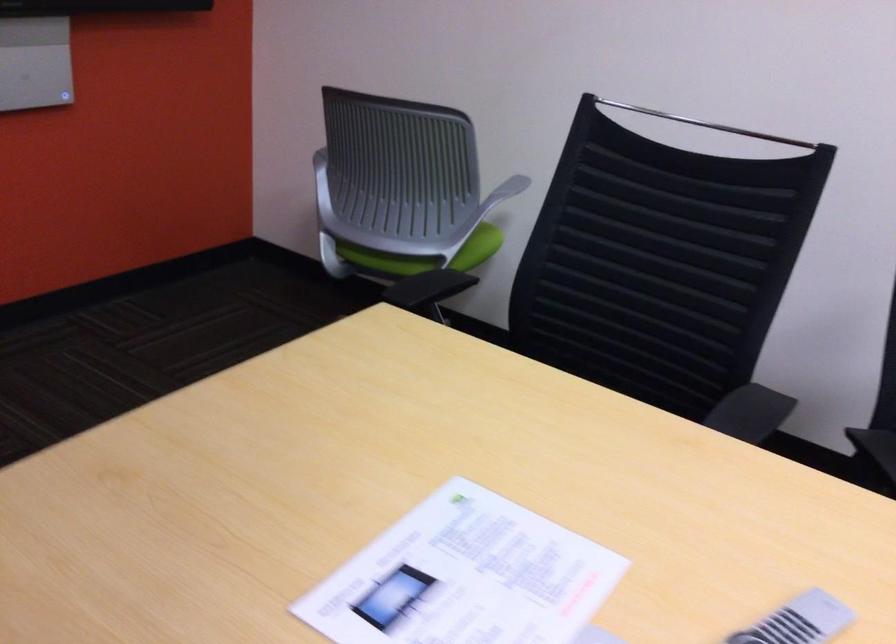
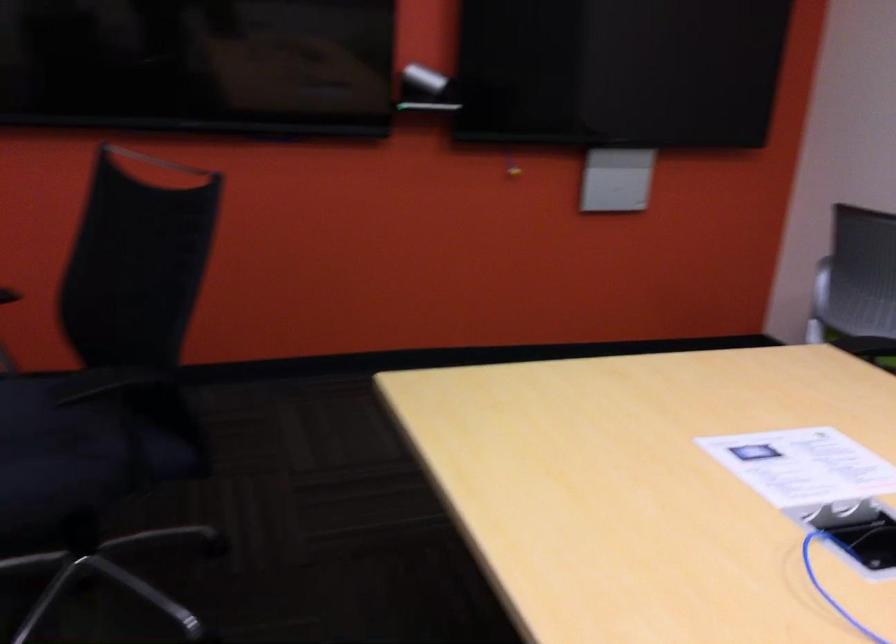
Question: The camera is either moving clockwise (left) or counter-clockwise (right) around the object. The first image is from the beginning of the video and the second image is from the end. Is the camera moving left or right when shooting the video?

Choices:
 (A) Left
 (B) Right

Answer: (B)